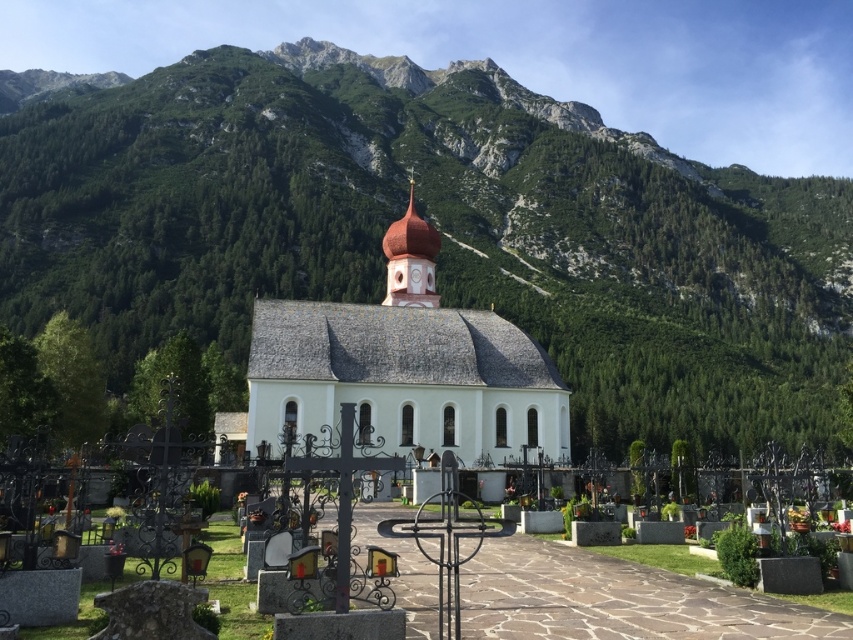
Question: Does white stone church at center lie in front of smooth white steeple at center?

Choices:
 (A) no
 (B) yes

Answer: (B)

Question: Does green forested mountain at upper center appear over smooth concrete tombstones at center?

Choices:
 (A) yes
 (B) no

Answer: (A)

Question: Which point is closer to the camera?

Choices:
 (A) white stone church at center
 (B) smooth concrete tombstones at center
 (C) green forested mountain at upper center
 (D) smooth white steeple at center

Answer: (B)

Question: Can you confirm if green forested mountain at upper center is positioned above white stone church at center?

Choices:
 (A) yes
 (B) no

Answer: (A)

Question: Which point appears closest to the camera in this image?

Choices:
 (A) (413, 234)
 (B) (424, 298)

Answer: (B)

Question: Which point is farther to the camera?

Choices:
 (A) green forested mountain at upper center
 (B) white stone church at center

Answer: (A)